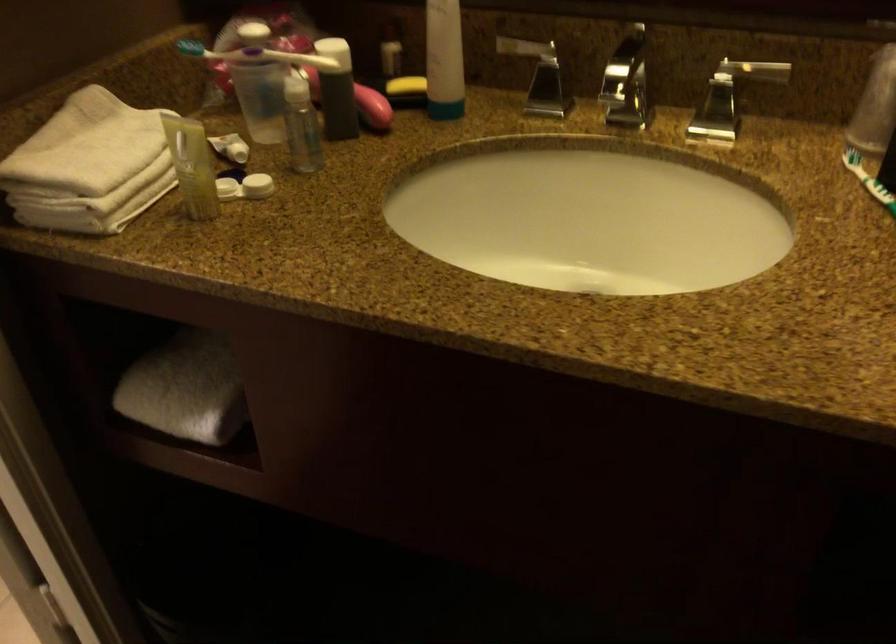
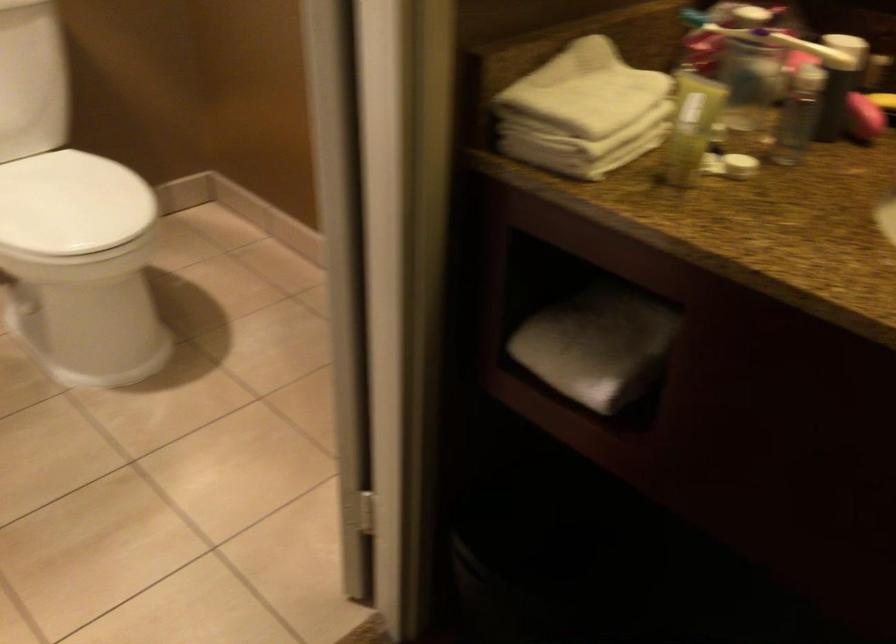
Question: The camera is either moving clockwise (left) or counter-clockwise (right) around the object. The first image is from the beginning of the video and the second image is from the end. Is the camera moving left or right when shooting the video?

Choices:
 (A) Left
 (B) Right

Answer: (B)